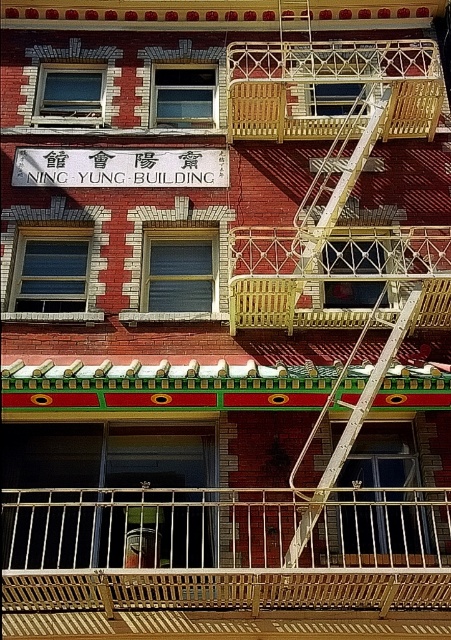
Question: Which object is farther from the camera taking this photo?

Choices:
 (A) wooden at center
 (B) white metal fire escape at center
 (C) wooden at upper center

Answer: (C)

Question: Which object appears closest to the camera in this image?

Choices:
 (A) wooden at center
 (B) white matte sign at center

Answer: (A)

Question: Does wooden at center appear on the left side of white metal fire escape at upper center?

Choices:
 (A) no
 (B) yes

Answer: (A)

Question: Where is wooden at center located in relation to white matte sign at center in the image?

Choices:
 (A) above
 (B) below

Answer: (B)

Question: Which point is closer to the camera?

Choices:
 (A) (40, 150)
 (B) (279, 129)

Answer: (B)

Question: Does wooden at upper center come behind wooden at center?

Choices:
 (A) yes
 (B) no

Answer: (A)